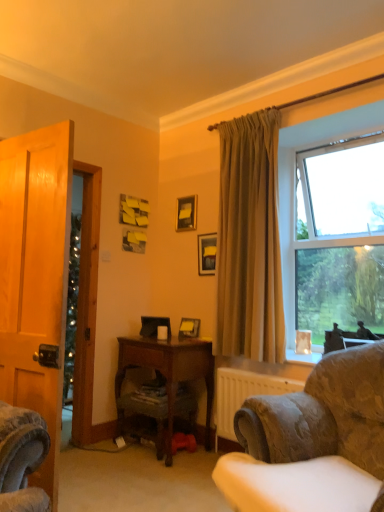
What do you see at coordinates (168, 372) in the screenshot?
I see `wooden desk at center` at bounding box center [168, 372].

The height and width of the screenshot is (512, 384). What do you see at coordinates (310, 147) in the screenshot? I see `clear glass window at upper right` at bounding box center [310, 147].

Identify the location of velvet-patterned armchair at lower right. (317, 441).

Where is `matte black picture frame at upper center, which ranks as the second picture frame in bottom-to-top order`? The height and width of the screenshot is (512, 384). matte black picture frame at upper center, which ranks as the second picture frame in bottom-to-top order is located at coordinates (207, 253).

The height and width of the screenshot is (512, 384). Describe the element at coordinates (249, 240) in the screenshot. I see `beige fabric curtain at upper right` at that location.

Image resolution: width=384 pixels, height=512 pixels. What do you see at coordinates (189, 327) in the screenshot? I see `wooden picture frame at center, the 3th picture frame viewed from the top` at bounding box center [189, 327].

Image resolution: width=384 pixels, height=512 pixels. In order to click on matte white coffee cup at center in this screenshot , I will do (x=162, y=333).

From the image's perspective, which one is positioned lower, beige fabric curtain at upper right or velvet-patterned armchair at lower right?

velvet-patterned armchair at lower right, from the image's perspective.

Looking at this image, can you tell me how much beige fabric curtain at upper right and velvet-patterned armchair at lower right differ in facing direction?

23.5 degrees.

Is beige fabric curtain at upper right positioned beyond the bounds of velvet-patterned armchair at lower right?

Yes, beige fabric curtain at upper right is outside of velvet-patterned armchair at lower right.

Between wooden picture frame at center, the 3th picture frame viewed from the top, and clear glass window at upper right, which one has smaller width?

wooden picture frame at center, the 3th picture frame viewed from the top, is thinner.

Measure the distance between wooden picture frame at center, the 3th picture frame viewed from the top, and clear glass window at upper right.

wooden picture frame at center, the 3th picture frame viewed from the top, and clear glass window at upper right are 1.32 meters apart from each other.

Considering the relative sizes of wooden picture frame at center, the 3th picture frame viewed from the top, and clear glass window at upper right in the image provided, is wooden picture frame at center, the 3th picture frame viewed from the top, bigger than clear glass window at upper right?

No.

Which is farther, (199, 327) or (292, 176)?

The point (199, 327) is behind.

Is point (207, 418) behind point (265, 307)?

Yes, it is.

Could you tell me if wooden desk at center is turned towards beige fabric curtain at upper right?

→ No, wooden desk at center is not aimed at beige fabric curtain at upper right.

Considering the sizes of objects wooden desk at center and beige fabric curtain at upper right in the image provided, who is wider, wooden desk at center or beige fabric curtain at upper right?

With larger width is wooden desk at center.

From the image's perspective, relative to beige fabric curtain at upper right, is wooden desk at center above or below?

From the image's perspective, wooden desk at center appears below beige fabric curtain at upper right.

Which of these two, velvet-patterned armchair at lower right or matte white coffee cup at center, is thinner?

matte white coffee cup at center.

How different are the orientations of velvet-patterned armchair at lower right and matte white coffee cup at center in degrees?

The angle between the facing direction of velvet-patterned armchair at lower right and the facing direction of matte white coffee cup at center is 23.5 degrees.

From the image's perspective, does velvet-patterned armchair at lower right appear higher than matte white coffee cup at center?

No, from the image's perspective, velvet-patterned armchair at lower right is not over matte white coffee cup at center.

In the image, is velvet-patterned armchair at lower right on the left side or the right side of matte white coffee cup at center?

In the image, velvet-patterned armchair at lower right appears on the right side of matte white coffee cup at center.

Considering the sizes of matte black picture frame at upper center, marked as the 1th picture frame in a top-to-bottom arrangement, and beige fabric curtain at upper right in the image, is matte black picture frame at upper center, marked as the 1th picture frame in a top-to-bottom arrangement, bigger or smaller than beige fabric curtain at upper right?

Considering their sizes, matte black picture frame at upper center, marked as the 1th picture frame in a top-to-bottom arrangement, takes up less space than beige fabric curtain at upper right.

Which is behind, matte black picture frame at upper center, marked as the 1th picture frame in a top-to-bottom arrangement, or beige fabric curtain at upper right?

matte black picture frame at upper center, marked as the 1th picture frame in a top-to-bottom arrangement, is behind.

This screenshot has width=384, height=512. I want to click on picture frame above the beige fabric curtain at upper right (from a real-world perspective), so click(186, 213).

How different are the orientations of matte black picture frame at upper center, marked as the 1th picture frame in a top-to-bottom arrangement, and beige fabric curtain at upper right in degrees?

matte black picture frame at upper center, marked as the 1th picture frame in a top-to-bottom arrangement, and beige fabric curtain at upper right are facing 5.13 degrees away from each other.

Consider the image. Between beige fabric curtain at upper right and wooden desk at center, which one has larger size?

wooden desk at center.

Could you tell me if beige fabric curtain at upper right is turned towards wooden desk at center?

No, beige fabric curtain at upper right is not oriented towards wooden desk at center.

Where is `desk below the beige fabric curtain at upper right (from a real-world perspective)`? The image size is (384, 512). desk below the beige fabric curtain at upper right (from a real-world perspective) is located at coordinates (168, 372).

From the image's perspective, which is below, matte black picture frame at upper center, marked as the 1th picture frame in a top-to-bottom arrangement, or wooden picture frame at center, placed as the first picture frame when sorted from bottom to top?

From the image's view, wooden picture frame at center, placed as the first picture frame when sorted from bottom to top, is below.

Is matte black picture frame at upper center, marked as the 1th picture frame in a top-to-bottom arrangement, not near wooden picture frame at center, placed as the first picture frame when sorted from bottom to top?

That's not correct — matte black picture frame at upper center, marked as the 1th picture frame in a top-to-bottom arrangement, is a little close to wooden picture frame at center, placed as the first picture frame when sorted from bottom to top.

How many degrees apart are the facing directions of matte black picture frame at upper center, marked as the 1th picture frame in a top-to-bottom arrangement, and wooden picture frame at center, placed as the first picture frame when sorted from bottom to top?

5.63 degrees separate the facing orientations of matte black picture frame at upper center, marked as the 1th picture frame in a top-to-bottom arrangement, and wooden picture frame at center, placed as the first picture frame when sorted from bottom to top.

In order to click on chair that appears below the beige fabric curtain at upper right (from the image's perspective) in this screenshot , I will do `click(317, 441)`.

This screenshot has height=512, width=384. Identify the location of window in front of the wooden picture frame at center, the 3th picture frame viewed from the top. (310, 147).

Considering their positions, is matte white coffee cup at center positioned further to velvet-patterned armchair at lower right than wooden desk at center?

matte white coffee cup at center.

Based on their spatial positions, is velvet-patterned armchair at lower right or wooden desk at center further from clear glass window at upper right?

The object further to clear glass window at upper right is velvet-patterned armchair at lower right.

When comparing their distances from beige fabric curtain at upper right, does velvet-patterned armchair at lower right or clear glass window at upper right seem closer?

Based on the image, clear glass window at upper right appears to be nearer to beige fabric curtain at upper right.

Estimate the real-world distances between objects in this image. Which object is closer to matte white coffee cup at center, wooden picture frame at center, the 3th picture frame viewed from the top, or matte black picture frame at upper center, marked as the 1th picture frame in a top-to-bottom arrangement?

wooden picture frame at center, the 3th picture frame viewed from the top, lies closer to matte white coffee cup at center than the other object.

Considering their positions, is wooden desk at center positioned further to wooden picture frame at center, the 3th picture frame viewed from the top, than clear glass window at upper right?

The object further to wooden picture frame at center, the 3th picture frame viewed from the top, is clear glass window at upper right.

Looking at the image, which one is located further to clear glass window at upper right, beige fabric curtain at upper right or matte black picture frame at upper center, which ranks as the second picture frame in bottom-to-top order?

Based on the image, matte black picture frame at upper center, which ranks as the second picture frame in bottom-to-top order, appears to be further to clear glass window at upper right.

Looking at the image, which one is located further to wooden desk at center, matte black picture frame at upper center, positioned as the 2th picture frame in top-to-bottom order, or velvet-patterned armchair at lower right?

velvet-patterned armchair at lower right is further to wooden desk at center.

From the image, which object appears to be farther from wooden picture frame at center, placed as the first picture frame when sorted from bottom to top, matte black picture frame at upper center, which ranks as the second picture frame in bottom-to-top order, or clear glass window at upper right?

Based on the image, clear glass window at upper right appears to be further to wooden picture frame at center, placed as the first picture frame when sorted from bottom to top.

Locate an element on the screen. picture frame between matte black picture frame at upper center, positioned as the 2th picture frame in top-to-bottom order, and matte white coffee cup at center from top to bottom is located at coordinates (189, 327).

Identify the location of coffee cup located between velvet-patterned armchair at lower right and matte black picture frame at upper center, which appears as the 3th picture frame when ordered from the bottom, in the depth direction. (162, 333).

Where is `curtain that lies between matte black picture frame at upper center, marked as the 1th picture frame in a top-to-bottom arrangement, and wooden desk at center from top to bottom`? curtain that lies between matte black picture frame at upper center, marked as the 1th picture frame in a top-to-bottom arrangement, and wooden desk at center from top to bottom is located at coordinates (249, 240).

Identify the location of curtain between velvet-patterned armchair at lower right and matte black picture frame at upper center, marked as the 1th picture frame in a top-to-bottom arrangement, along the z-axis. (249, 240).